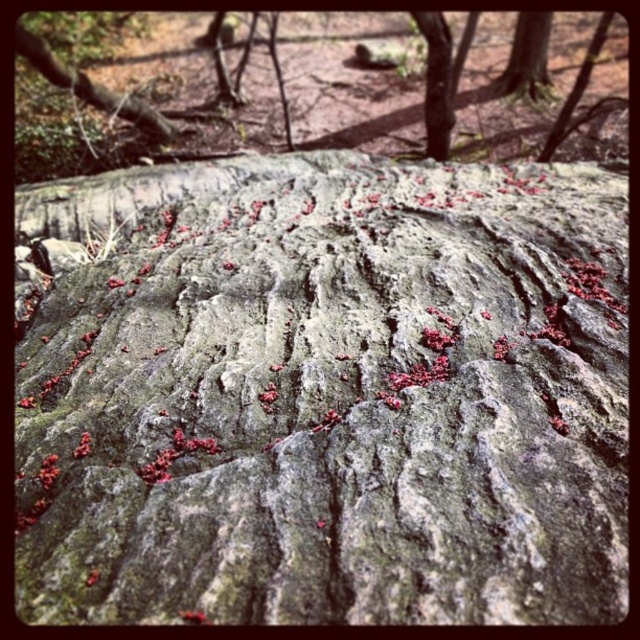
Between point (572, 556) and point (449, 70), which one is positioned behind?

The point (449, 70) is more distant.

Describe the element at coordinates (326, 396) in the screenshot. I see `green mossy rock at center` at that location.

Between point (406, 321) and point (433, 10), which one is positioned in front?

Point (406, 321)

This screenshot has height=640, width=640. In order to click on green mossy rock at center in this screenshot , I will do `click(326, 396)`.

Does green mossy rock at center have a lesser height compared to rough bark tree trunk at center?

Correct, green mossy rock at center is not as tall as rough bark tree trunk at center.

Is point (152, 472) farther from camera compared to point (477, 77)?

That is False.

Find the location of a particular element. This screenshot has width=640, height=640. green mossy rock at center is located at coordinates (326, 396).

Locate an element on the screen. The image size is (640, 640). rough bark tree trunk at center is located at coordinates (291, 86).

Is rough bark tree trunk at center below smooth bark tree trunk at upper center?

No.

Between point (308, 113) and point (429, 141), which one is positioned behind?

The point (308, 113) is behind.

Locate an element on the screen. The height and width of the screenshot is (640, 640). rough bark tree trunk at center is located at coordinates (291, 86).